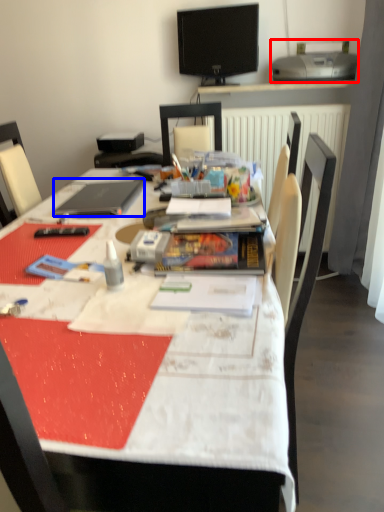
Question: Which of the following is the closest to the observer, printer (highlighted by a red box) or laptop (highlighted by a blue box)?

Choices:
 (A) printer
 (B) laptop

Answer: (B)